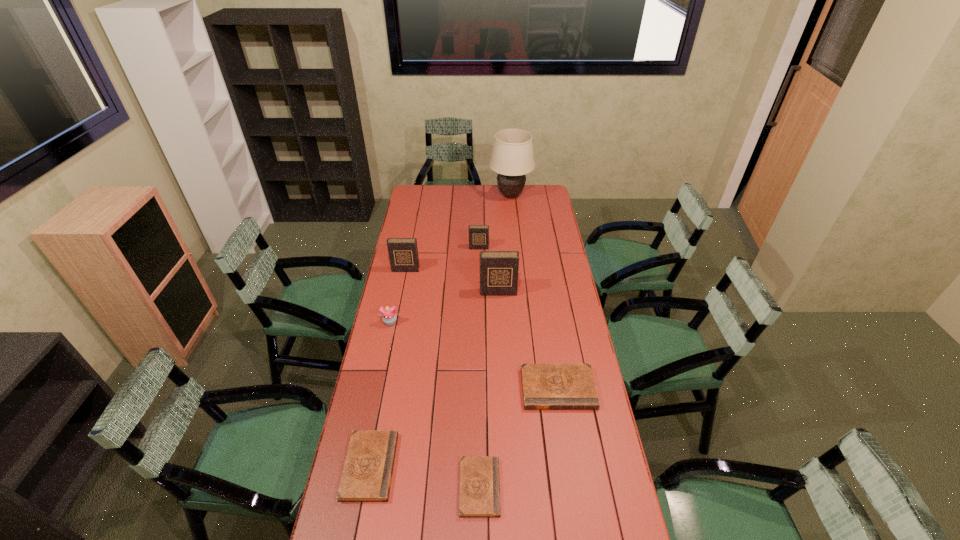
Locate an element on the screen. The width and height of the screenshot is (960, 540). blank space located 0.220m on the face of the fourth nearest object is located at coordinates (380, 369).

The width and height of the screenshot is (960, 540). In order to click on free point located 0.350m on the spine side of the sixth tallest object in this screenshot , I will do `click(578, 512)`.

Locate an element on the screen. blank space located on the spine side of the second shortest diary is located at coordinates (504, 466).

Where is `free spot located 0.300m on the spine side of the shortest diary`? This screenshot has width=960, height=540. free spot located 0.300m on the spine side of the shortest diary is located at coordinates (594, 487).

Locate an element on the screen. object at the far edge is located at coordinates (512, 157).

This screenshot has width=960, height=540. Find the location of `cupcake situated at the left edge`. cupcake situated at the left edge is located at coordinates (389, 317).

Identify the location of lampshade located at the right edge. (512, 157).

The image size is (960, 540). In order to click on diary present at the right edge in this screenshot , I will do `click(545, 386)`.

What are the coordinates of `object that is at the far right corner` in the screenshot? It's located at (512, 157).

Find the location of a particular element. vacant space at the far edge of the desktop is located at coordinates tap(485, 197).